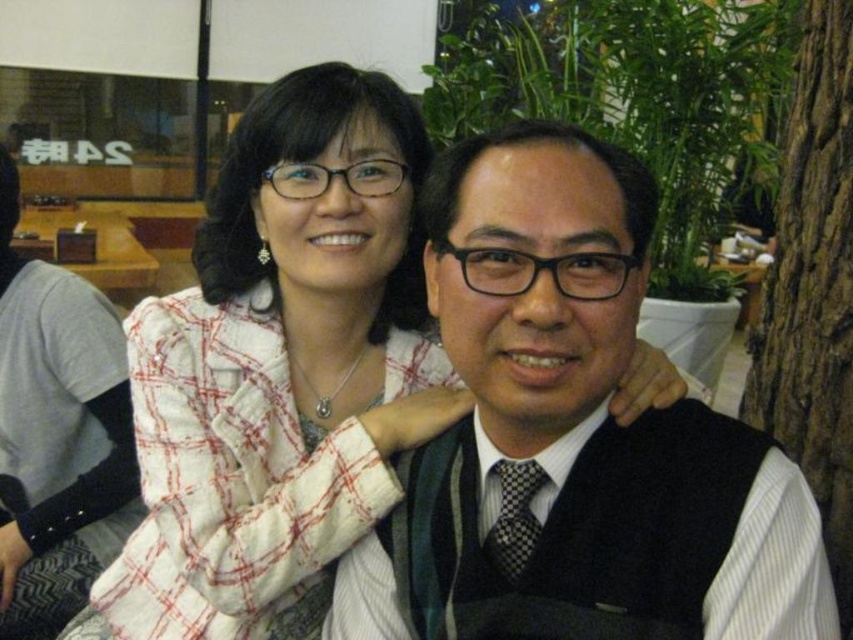
You are a photographer adjusting the camera focus. The camera has a focus point at coordinates 0.5, 0.3. Which object from the scene, the white checkered jacket at upper center, is closer to the focus point?

The white checkered jacket at upper center is closer to the focus point at (254, 320) because its position is at (280, 369), which is very near to the focus coordinates.

You are standing in the room and want to hand a gift to the person wearing the matte black vest at center. If your arm can reach 60 centimeters, can you reach them without moving closer?

The matte black vest at center and viewer are 60.99 centimeters apart from each other. Since your arm can reach 60 centimeters, you cannot quite reach them as the distance is slightly more than your arm length. You would need to move a little closer.

You are taking a photo of the matte black vest at center and the white checkered jacket at upper center. Which object should you focus on first to ensure both are in sharp focus?

You should focus on the matte black vest at center first because it is closer to the viewer than the white checkered jacket at upper center. By focusing on the closer object, the farther one will also be in focus due to the depth of field.